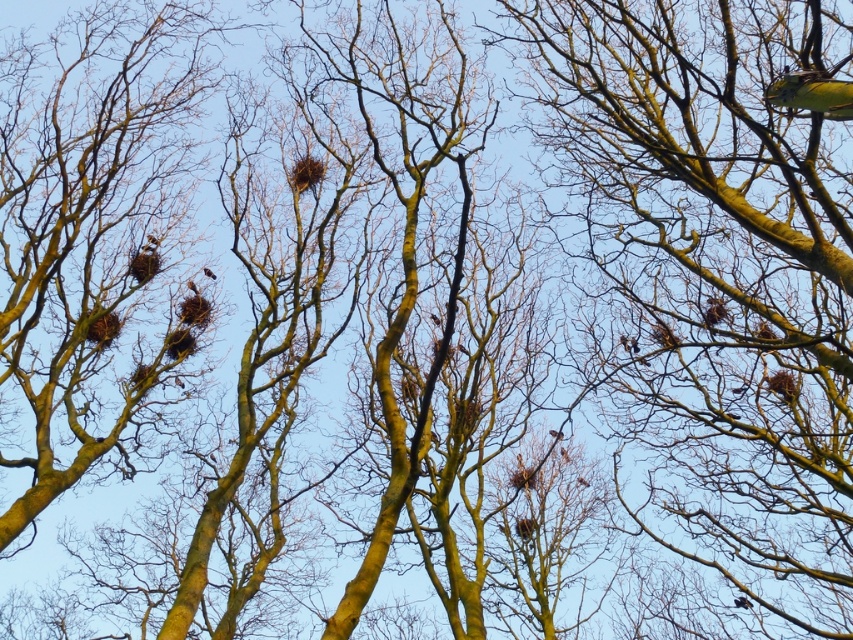
In the scene shown: You are a bird looking for a nesting spot. You notice the smooth bark tree at upper right. Based on its location, can you determine if it is positioned in the upper half of the image?

The smooth bark tree at upper right is located at point [718,273], which falls within the upper half of the image since the y coordinate is above 0.5. Therefore, it is positioned in the upper half of the image.